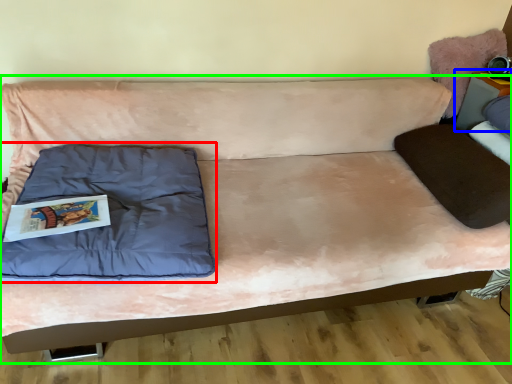
Question: Based on their relative distances, which object is farther from pillow (highlighted by a red box)? Choose from table (highlighted by a blue box) and studio couch (highlighted by a green box).

Choices:
 (A) table
 (B) studio couch

Answer: (A)